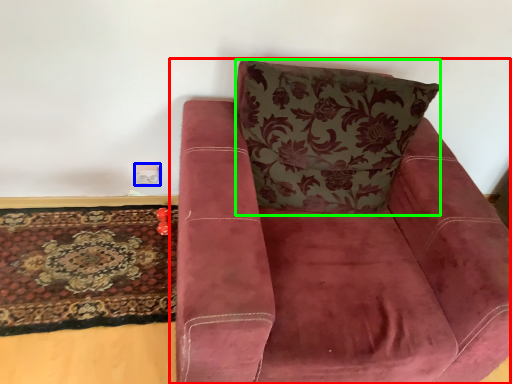
Question: Based on their relative distances, which object is nearer to chair (highlighted by a red box)? Choose from electric outlet (highlighted by a blue box) and throw pillow (highlighted by a green box).

Choices:
 (A) electric outlet
 (B) throw pillow

Answer: (B)